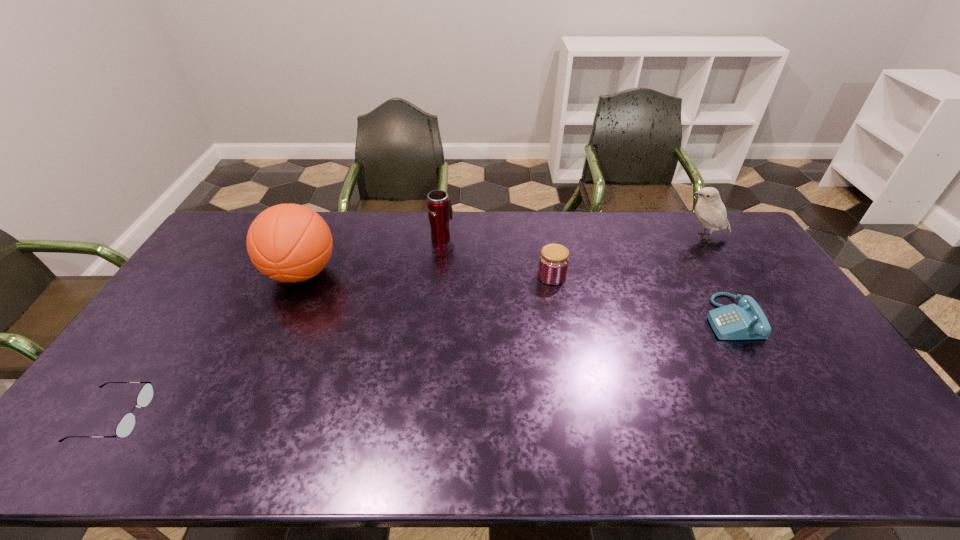
At what (x,y) coordinates should I click in order to perform the action: click on vacant point located between the third shortest object and the shortest object. Please return your answer as a coordinate pair (x, y). Looking at the image, I should click on (332, 346).

This screenshot has width=960, height=540. Identify the location of blank region between the fifth tallest object and the bird. (717, 278).

Identify the location of vacant region between the shortest object and the telephone. (421, 367).

In order to click on unoccupied position between the bird and the jam in this screenshot , I will do `click(628, 256)`.

Point out which object is positioned as the third nearest to the leftmost object. Please provide its 2D coordinates. Your answer should be formatted as a tuple, i.e. [(x, y)], where the tuple contains the x and y coordinates of a point satisfying the conditions above.

[(554, 259)]

This screenshot has width=960, height=540. Find the location of `the closest object to the jam`. the closest object to the jam is located at coordinates (440, 212).